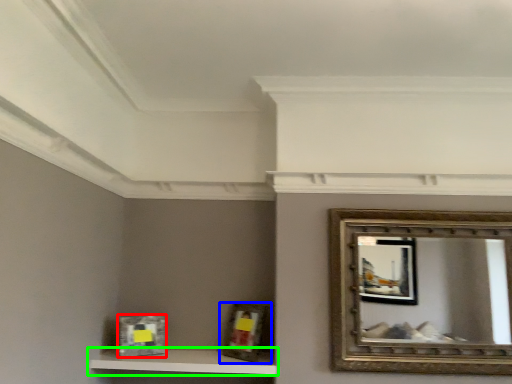
Question: Estimate the real-world distances between objects in this image. Which object is closer to picture frame (highlighted by a red box), picture frame (highlighted by a blue box) or shelf (highlighted by a green box)?

Choices:
 (A) picture frame
 (B) shelf

Answer: (B)